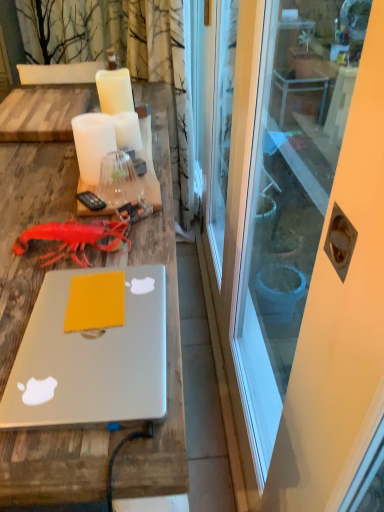
Image resolution: width=384 pixels, height=512 pixels. What do you see at coordinates (75, 239) in the screenshot?
I see `rubber matte lobster at center` at bounding box center [75, 239].

Consider the image. In order to face silver metallic laptop at center, should I rotate leftwards or rightwards?

You should rotate left by 13.355 degrees.

You are a GUI agent. You are given a task and a screenshot of the screen. Output one action in this format:
    pyautogui.click(x=<x>, y=<y>)
    Task: Click on the silver metallic laptop at center
    
    Given the screenshot: What is the action you would take?
    pyautogui.click(x=91, y=359)

Where is `white matte candle at center, acting as the second candle starting from the back`? This screenshot has height=512, width=384. white matte candle at center, acting as the second candle starting from the back is located at coordinates (114, 91).

This screenshot has height=512, width=384. What do you see at coordinates (127, 130) in the screenshot?
I see `white matte candle at center, marked as the third candle in a front-to-back arrangement` at bounding box center [127, 130].

How much space does white matte candle at center, marked as the third candle in a front-to-back arrangement, occupy horizontally?

It is 2.82 inches.

The height and width of the screenshot is (512, 384). What do you see at coordinates (92, 143) in the screenshot? I see `white matte candle at upper center, the 1th candle when ordered from front to back` at bounding box center [92, 143].

Where is `rubber matte lobster at center`? The width and height of the screenshot is (384, 512). rubber matte lobster at center is located at coordinates (75, 239).

Is white matte candle at center, which appears as the 2th candle when viewed from the front, not within silver metallic laptop at center?

white matte candle at center, which appears as the 2th candle when viewed from the front, is positioned outside silver metallic laptop at center.

From their relative heights in the image, would you say white matte candle at center, which appears as the 2th candle when viewed from the front, is taller or shorter than silver metallic laptop at center?

In the image, white matte candle at center, which appears as the 2th candle when viewed from the front, appears to be taller than silver metallic laptop at center.

Which object is thinner, white matte candle at center, acting as the second candle starting from the back, or silver metallic laptop at center?

white matte candle at center, acting as the second candle starting from the back.

From a real-world perspective, is white matte candle at center, marked as the third candle in a front-to-back arrangement, above or below white matte candle at center, which appears as the 2th candle when viewed from the front?

white matte candle at center, marked as the third candle in a front-to-back arrangement, is below white matte candle at center, which appears as the 2th candle when viewed from the front.

How many degrees apart are the facing directions of white matte candle at center, marked as the third candle in a front-to-back arrangement, and white matte candle at center, which appears as the 2th candle when viewed from the front?

The angle between the facing direction of white matte candle at center, marked as the third candle in a front-to-back arrangement, and the facing direction of white matte candle at center, which appears as the 2th candle when viewed from the front, is 0.00362 degrees.

Between point (124, 124) and point (133, 110), which one is positioned behind?

The point (133, 110) is more distant.

Find the location of a particular element. The width and height of the screenshot is (384, 512). the 1st candle to the left of the white matte candle at center, marked as the third candle in a front-to-back arrangement, counting from the anchor's position is located at coordinates (114, 91).

From a real-world perspective, which is physically above, white matte candle at upper center, the 1th candle when ordered from front to back, or white matte candle at center, marked as the third candle in a front-to-back arrangement?

From a 3D spatial view, white matte candle at upper center, the 1th candle when ordered from front to back, is above.

Can you confirm if white matte candle at upper center, placed as the third candle when sorted from back to front, is positioned to the left of white matte candle at center, marked as the third candle in a front-to-back arrangement?

Yes.

From the image's perspective, between white matte candle at upper center, the 1th candle when ordered from front to back, and white matte candle at center, acting as the first candle starting from the back, which one is located above?

white matte candle at center, acting as the first candle starting from the back, from the image's perspective.

Is white matte candle at center, marked as the third candle in a front-to-back arrangement, shorter than yellow matte notepad at center?

In fact, white matte candle at center, marked as the third candle in a front-to-back arrangement, may be taller than yellow matte notepad at center.

Which is behind, point (137, 137) or point (118, 306)?

The point (137, 137) is more distant.

Does white matte candle at center, acting as the first candle starting from the back, appear on the left side of yellow matte notepad at center?

Correct, you'll find white matte candle at center, acting as the first candle starting from the back, to the left of yellow matte notepad at center.

Which object is further away from the camera taking this photo, white matte candle at center, acting as the first candle starting from the back, or yellow matte notepad at center?

white matte candle at center, acting as the first candle starting from the back, is further away from the camera.

Does white matte candle at center, acting as the first candle starting from the back, touch white glossy screen door at center?

No, white matte candle at center, acting as the first candle starting from the back, is not next to white glossy screen door at center.

In the scene shown: Can you confirm if white matte candle at center, acting as the first candle starting from the back, is thinner than white glossy screen door at center?

Yes, white matte candle at center, acting as the first candle starting from the back, is thinner than white glossy screen door at center.

Is white matte candle at center, marked as the third candle in a front-to-back arrangement, outside of white glossy screen door at center?

Yes, white matte candle at center, marked as the third candle in a front-to-back arrangement, is not within white glossy screen door at center.

Is point (133, 129) positioned after point (328, 140)?

No, (133, 129) is in front of (328, 140).

Could silver metallic laptop at center be considered to be inside white matte candle at center, acting as the first candle starting from the back?

Actually, silver metallic laptop at center is outside white matte candle at center, acting as the first candle starting from the back.

Can you tell me how much white matte candle at center, acting as the first candle starting from the back, and silver metallic laptop at center differ in facing direction?

The facing directions of white matte candle at center, acting as the first candle starting from the back, and silver metallic laptop at center are 0.00155 degrees apart.

From their relative heights in the image, would you say white matte candle at center, marked as the third candle in a front-to-back arrangement, is taller or shorter than silver metallic laptop at center?

In the image, white matte candle at center, marked as the third candle in a front-to-back arrangement, appears to be taller than silver metallic laptop at center.

What are the coordinates of `laptop lying in front of the white matte candle at center, acting as the first candle starting from the back` in the screenshot? It's located at (91, 359).

From the image's perspective, between white matte candle at center, acting as the second candle starting from the back, and white glossy screen door at center, who is located below?

white glossy screen door at center is shown below in the image.

Which is in front, white matte candle at center, which appears as the 2th candle when viewed from the front, or white glossy screen door at center?

white glossy screen door at center.

Is white matte candle at center, which appears as the 2th candle when viewed from the front, inside the boundaries of white glossy screen door at center, or outside?

white matte candle at center, which appears as the 2th candle when viewed from the front, is not inside white glossy screen door at center, it's outside.

Which object is positioned more to the left, white matte candle at center, acting as the second candle starting from the back, or white glossy screen door at center?

Positioned to the left is white matte candle at center, acting as the second candle starting from the back.

Where is `the 2nd candle counting from the left of the silver metallic laptop at center`? the 2nd candle counting from the left of the silver metallic laptop at center is located at coordinates (114, 91).

Starting from the white matte candle at center, marked as the third candle in a front-to-back arrangement, which candle is the 1st one in front? Please provide its 2D coordinates.

[(114, 91)]

Based on their spatial positions, is white matte candle at center, marked as the third candle in a front-to-back arrangement, or rubber matte lobster at center further from white matte candle at center, which appears as the 2th candle when viewed from the front?

Based on the image, rubber matte lobster at center appears to be further to white matte candle at center, which appears as the 2th candle when viewed from the front.

Considering their positions, is rubber matte lobster at center positioned further to white matte candle at center, marked as the third candle in a front-to-back arrangement, than white matte candle at upper center, the 1th candle when ordered from front to back?

rubber matte lobster at center.

In the scene shown: Which object lies further to the anchor point white matte candle at center, which appears as the 2th candle when viewed from the front, silver metallic laptop at center or rubber matte lobster at center?

Based on the image, silver metallic laptop at center appears to be further to white matte candle at center, which appears as the 2th candle when viewed from the front.

Looking at the image, which one is located further to white matte candle at upper center, the 1th candle when ordered from front to back, white glossy screen door at center or rubber matte lobster at center?

The object further to white matte candle at upper center, the 1th candle when ordered from front to back, is white glossy screen door at center.

Based on their spatial positions, is rubber matte lobster at center or white matte candle at upper center, placed as the third candle when sorted from back to front, further from white glossy screen door at center?

rubber matte lobster at center lies further to white glossy screen door at center than the other object.

Considering their positions, is rubber matte lobster at center positioned closer to white glossy screen door at center than silver metallic laptop at center?

Based on the image, silver metallic laptop at center appears to be nearer to white glossy screen door at center.

Which object lies nearer to the anchor point rubber matte lobster at center, white glossy screen door at center or yellow matte notepad at center?

yellow matte notepad at center.

Estimate the real-world distances between objects in this image. Which object is closer to white matte candle at center, marked as the third candle in a front-to-back arrangement, white matte candle at upper center, placed as the third candle when sorted from back to front, or white matte candle at center, which appears as the 2th candle when viewed from the front?

white matte candle at center, which appears as the 2th candle when viewed from the front, is closer to white matte candle at center, marked as the third candle in a front-to-back arrangement.

The height and width of the screenshot is (512, 384). What are the coordinates of `lobster located between silver metallic laptop at center and white matte candle at upper center, placed as the third candle when sorted from back to front, in the depth direction` in the screenshot? It's located at (75, 239).

You are a GUI agent. You are given a task and a screenshot of the screen. Output one action in this format:
    pyautogui.click(x=<x>, y=<y>)
    Task: Click on the notepad between white glossy screen door at center and white matte candle at center, which appears as the 2th candle when viewed from the front, along the z-axis
    The height and width of the screenshot is (512, 384).
    Given the screenshot: What is the action you would take?
    pos(95,302)

Where is `lobster located between silver metallic laptop at center and white matte candle at center, marked as the third candle in a front-to-back arrangement, in the depth direction`? The height and width of the screenshot is (512, 384). lobster located between silver metallic laptop at center and white matte candle at center, marked as the third candle in a front-to-back arrangement, in the depth direction is located at coordinates (75, 239).

Locate an element on the screen. This screenshot has height=512, width=384. candle between white glossy screen door at center and white matte candle at center, which appears as the 2th candle when viewed from the front, along the z-axis is located at coordinates point(92,143).